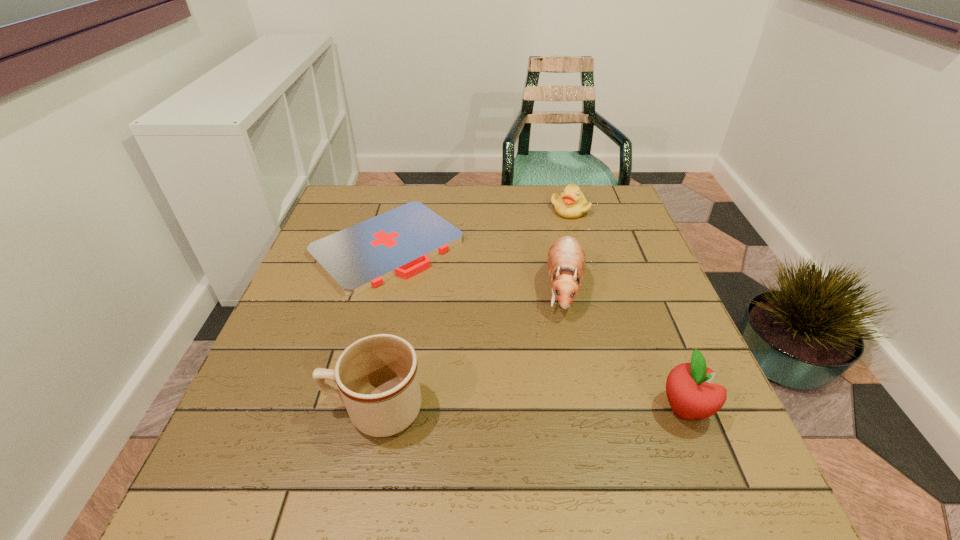
Locate an element on the screen. apple present at the near edge is located at coordinates 689,390.

Locate an element on the screen. This screenshot has height=540, width=960. object positioned at the left edge is located at coordinates (400, 242).

Locate an element on the screen. Image resolution: width=960 pixels, height=540 pixels. apple present at the right edge is located at coordinates (689, 390).

The image size is (960, 540). Find the location of `duckling present at the right edge`. duckling present at the right edge is located at coordinates (571, 204).

The image size is (960, 540). I want to click on object located at the far left corner, so click(x=400, y=242).

Locate an element on the screen. object that is at the far right corner is located at coordinates [x=571, y=204].

The width and height of the screenshot is (960, 540). I want to click on object that is at the near right corner, so click(689, 390).

Find the location of a particular element. free space at the far edge of the desktop is located at coordinates (396, 199).

This screenshot has width=960, height=540. In the image, there is a desktop. Find the location of `vacant space at the near edge`. vacant space at the near edge is located at coordinates (459, 423).

Find the location of a particular element. The image size is (960, 540). free region at the left edge is located at coordinates coord(326,286).